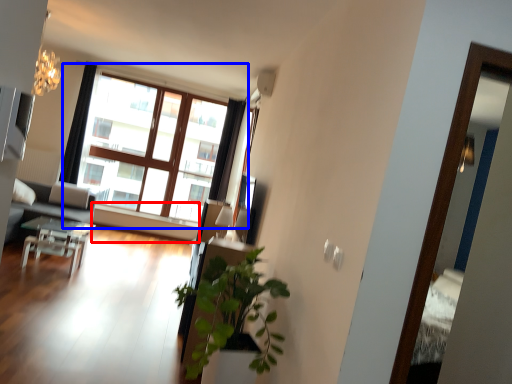
Question: Which object is further to the camera taking this photo, window sill (highlighted by a red box) or window (highlighted by a blue box)?

Choices:
 (A) window sill
 (B) window

Answer: (A)